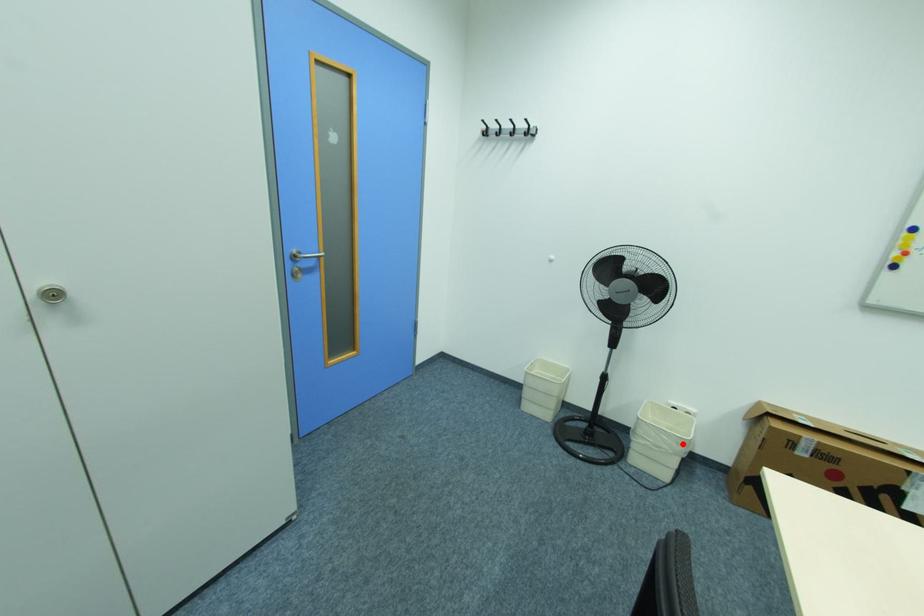
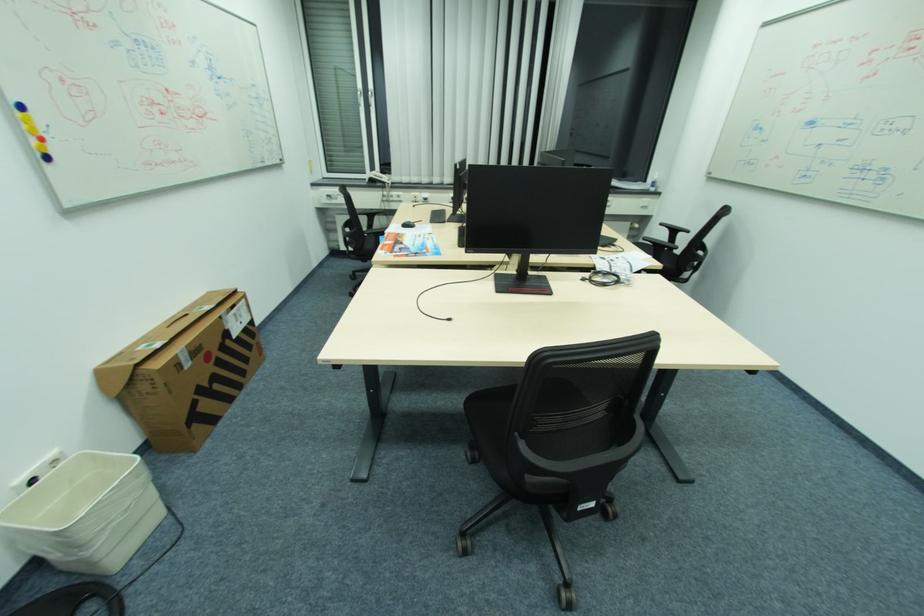
Find the pixel in the second image that matches the highlighted location in the first image.

(143, 476)